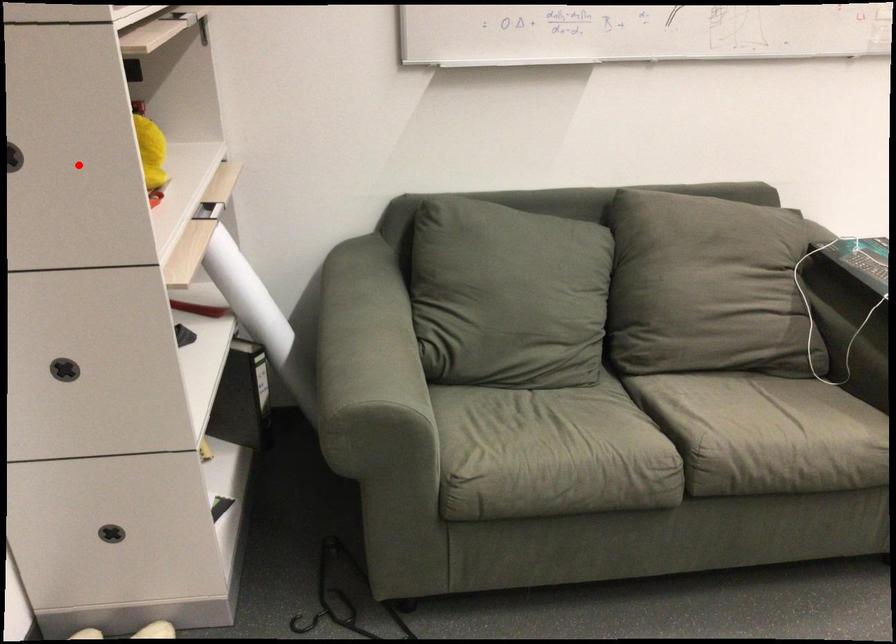
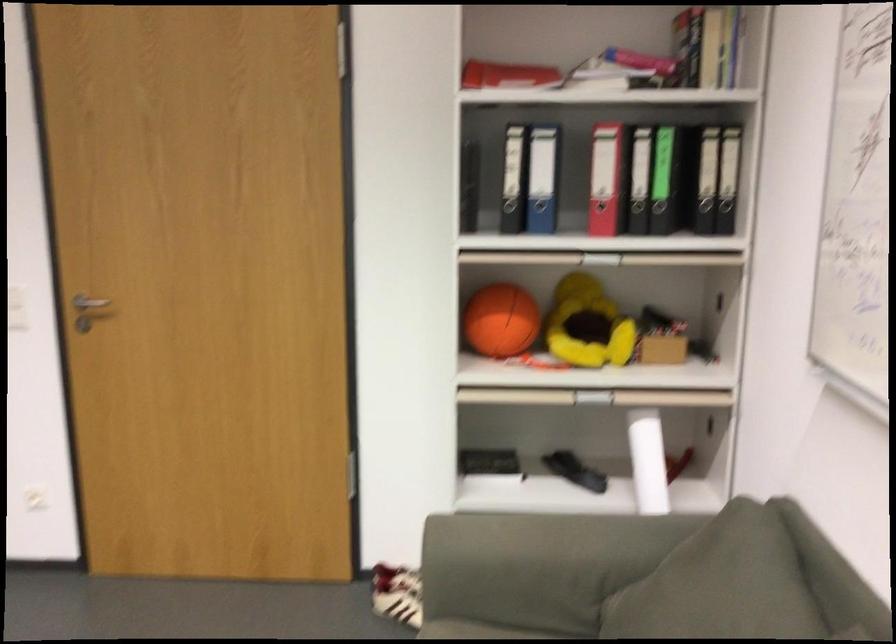
Find the pixel in the second image that matches the highlighted location in the first image.

(501, 321)